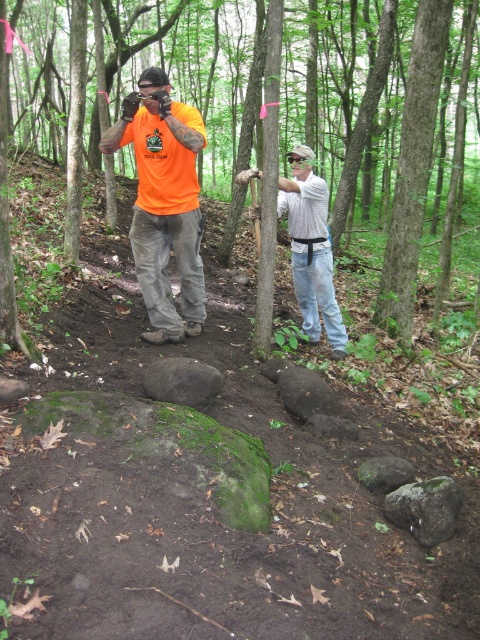
Which is above, orange t-shirt at center or gray rough rock at center?

orange t-shirt at center

Can you confirm if orange t-shirt at center is wider than gray rough rock at center?

Correct, the width of orange t-shirt at center exceeds that of gray rough rock at center.

This screenshot has width=480, height=640. Identify the location of orange t-shirt at center. (164, 202).

Is point (428, 483) closer to camera compared to point (376, 483)?

Yes, it is.

Is point (392, 506) positioned after point (405, 465)?

No, it is in front of (405, 465).

What do you see at coordinates (424, 508) in the screenshot?
I see `green mossy rock at lower right` at bounding box center [424, 508].

The height and width of the screenshot is (640, 480). Find the location of `green mossy rock at lower right`. green mossy rock at lower right is located at coordinates (424, 508).

Which of these two, smooth bark tree at center or green mossy rock at lower right, stands shorter?

Standing shorter between the two is green mossy rock at lower right.

Based on the photo, does smooth bark tree at center have a greater width compared to green mossy rock at lower right?

Yes, smooth bark tree at center is wider than green mossy rock at lower right.

This screenshot has width=480, height=640. I want to click on smooth bark tree at center, so click(412, 168).

At what (x,y) coordinates should I click in order to perform the action: click on smooth bark tree at center. Please return your answer as a coordinate pair (x, y). This screenshot has width=480, height=640. Looking at the image, I should click on (412, 168).